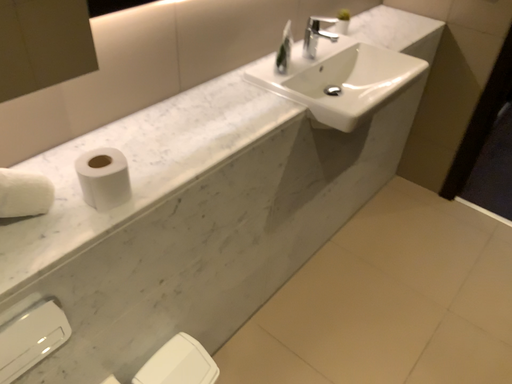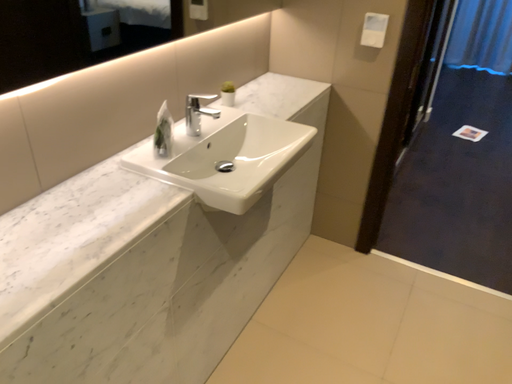
Question: Which way did the camera rotate in the video?

Choices:
 (A) rotated downward
 (B) rotated upward

Answer: (B)